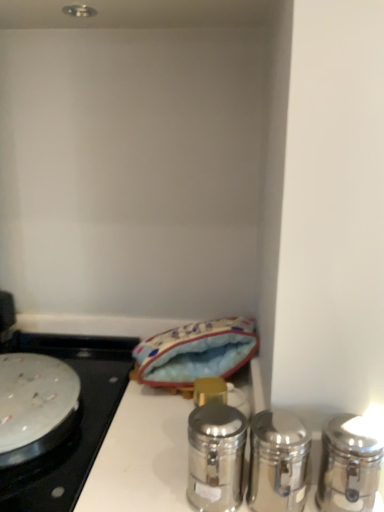
Question: From a real-world perspective, is polished silver shaker at right, positioned as the 3th salt and pepper shakers in left-to-right order, above or below blue fabric pouch at center?

Choices:
 (A) above
 (B) below

Answer: (A)

Question: From their relative heights in the image, would you say polished silver shaker at right, which ranks as the 1th salt and pepper shakers in right-to-left order, is taller or shorter than blue fabric pouch at center?

Choices:
 (A) tall
 (B) short

Answer: (B)

Question: Considering the real-world distances, which object is closest to the silver metallic pan at left?

Choices:
 (A) polished silver shaker at right, positioned as the 3th salt and pepper shakers in left-to-right order
 (B) blue fabric pouch at center
 (C) polished silver shaker at center, the 3th salt and pepper shakers viewed from the right
 (D) polished silver shaker at right, positioned as the 2th salt and pepper shakers in right-to-left order

Answer: (B)

Question: Which object is the closest to the blue fabric pouch at center?

Choices:
 (A) silver metallic pan at left
 (B) polished silver shaker at right, positioned as the 3th salt and pepper shakers in left-to-right order
 (C) polished silver shaker at center, the 3th salt and pepper shakers viewed from the right
 (D) polished silver shaker at right, the 2th salt and pepper shakers when ordered from left to right

Answer: (A)